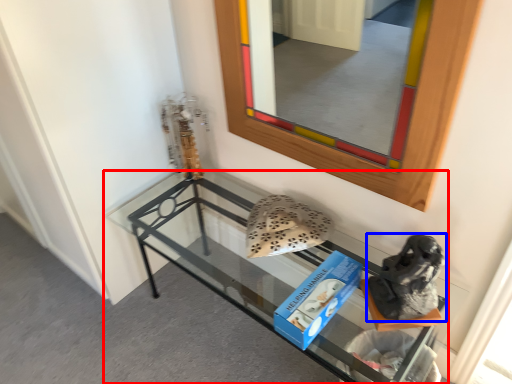
Question: Which of the following is the farthest to the observer, shelf (highlighted by a red box) or footwear (highlighted by a blue box)?

Choices:
 (A) shelf
 (B) footwear

Answer: (B)